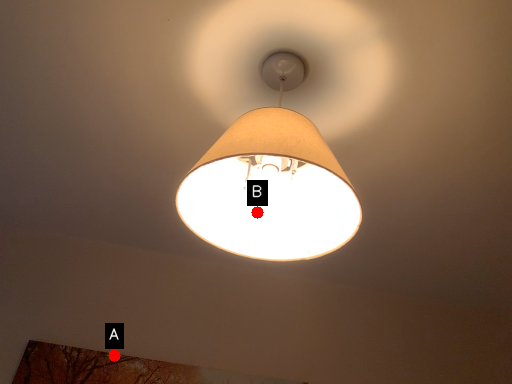
Question: Two points are circled on the image, labeled by A and B beside each circle. Which point is closer to the camera?

Choices:
 (A) A is closer
 (B) B is closer

Answer: (B)